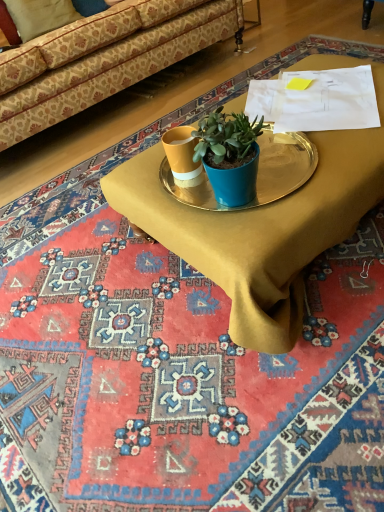
This screenshot has width=384, height=512. I want to click on vacant area that lies in front of metallic gold tray at center, so click(x=248, y=228).